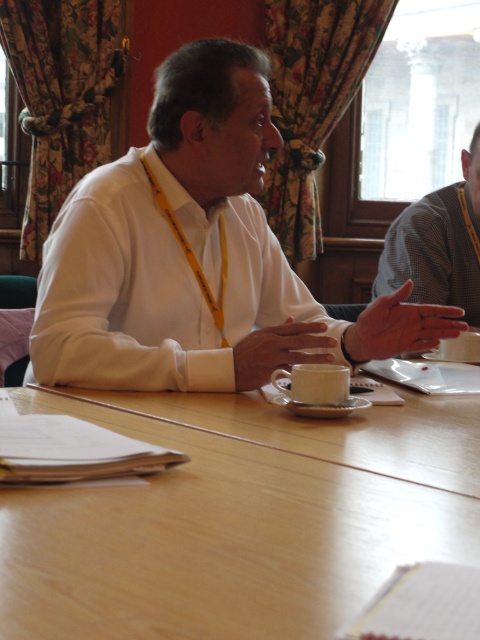
Question: Is light wood table at center to the left of wooden table at center from the viewer's perspective?

Choices:
 (A) yes
 (B) no

Answer: (A)

Question: Which point is farther to the camera?

Choices:
 (A) white matte cup at center
 (B) white matte shirt at center
 (C) gray checkered shirt at right

Answer: (C)

Question: Which object is positioned closest to the white matte cup at center?

Choices:
 (A) gray checkered shirt at right
 (B) wooden table at center

Answer: (B)

Question: Is light wood table at center positioned at the back of gray checkered shirt at right?

Choices:
 (A) no
 (B) yes

Answer: (A)

Question: Which point appears farthest from the camera in this image?

Choices:
 (A) (175, 253)
 (B) (220, 525)
 (C) (312, 400)

Answer: (A)

Question: Is wooden table at center smaller than white matte cup at center?

Choices:
 (A) no
 (B) yes

Answer: (A)